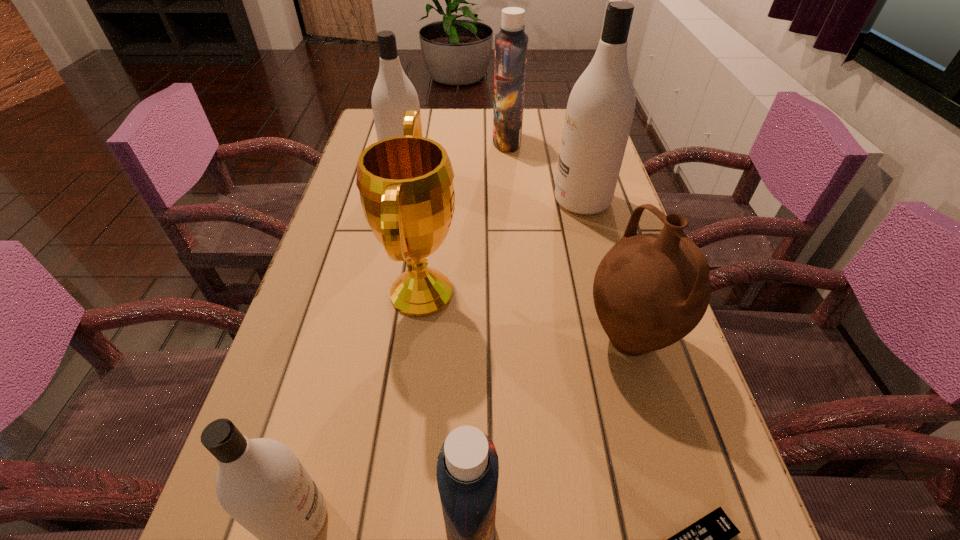
I want to click on vacant space situated on the front label of the fifth object from left to right, so click(437, 141).

Find the location of `vacant space located 0.230m on the front label of the fifth object from left to right`. vacant space located 0.230m on the front label of the fifth object from left to right is located at coordinates (418, 141).

Find the location of a particular element. Image resolution: width=960 pixels, height=540 pixels. vacant space located on the front label of the fifth object from left to right is located at coordinates (x=464, y=141).

Where is `free space located on the front-facing side of the second smallest white shampoo`? The image size is (960, 540). free space located on the front-facing side of the second smallest white shampoo is located at coordinates (563, 173).

What are the coordinates of `blank space located 0.300m on the front-facing side of the award` in the screenshot? It's located at (605, 293).

Identify the location of free space located on the front of the pitcher. (652, 421).

Locate an element on the screen. The image size is (960, 540). object present at the far edge is located at coordinates click(x=511, y=44).

Where is `object present at the left edge`? The height and width of the screenshot is (540, 960). object present at the left edge is located at coordinates (393, 93).

This screenshot has height=540, width=960. Find the location of `shampoo positioned at the right edge`. shampoo positioned at the right edge is located at coordinates (600, 108).

This screenshot has width=960, height=540. Identify the location of pitcher that is at the right edge. (650, 290).